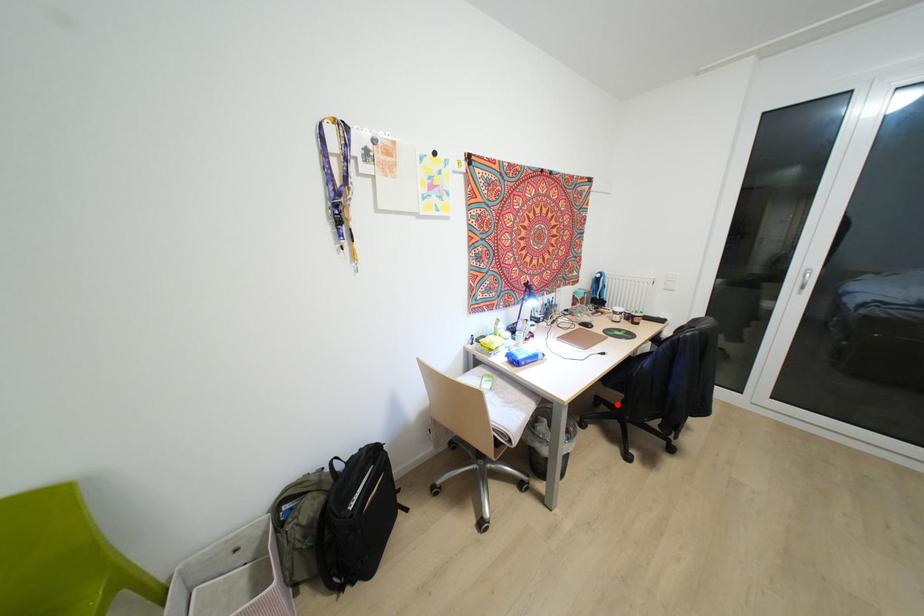
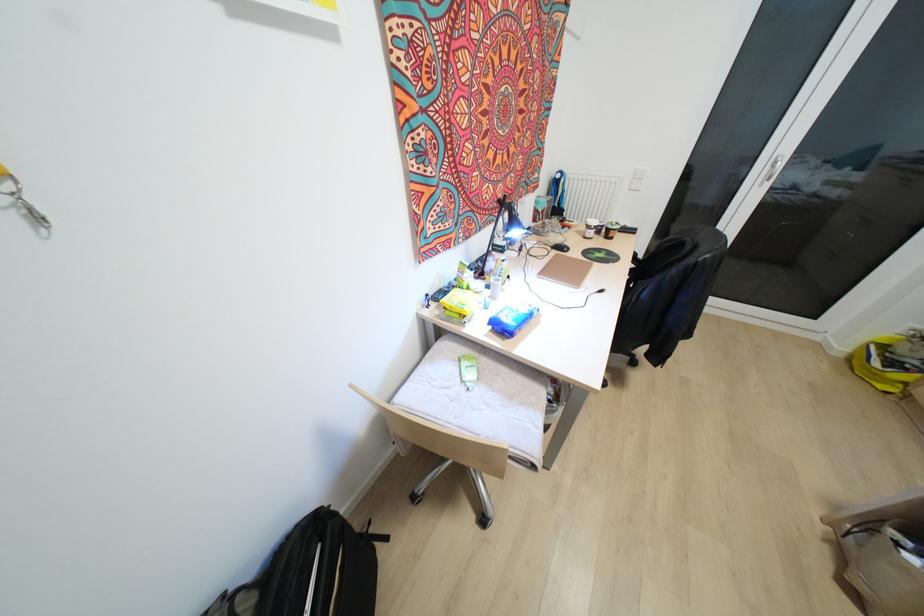
Question: I am providing you with two images of the same scene from different viewpoints. A red point is marked on the first image. At the location where the point appears in image 1, is it still visible in image 2?

Choices:
 (A) Yes
 (B) No

Answer: (B)